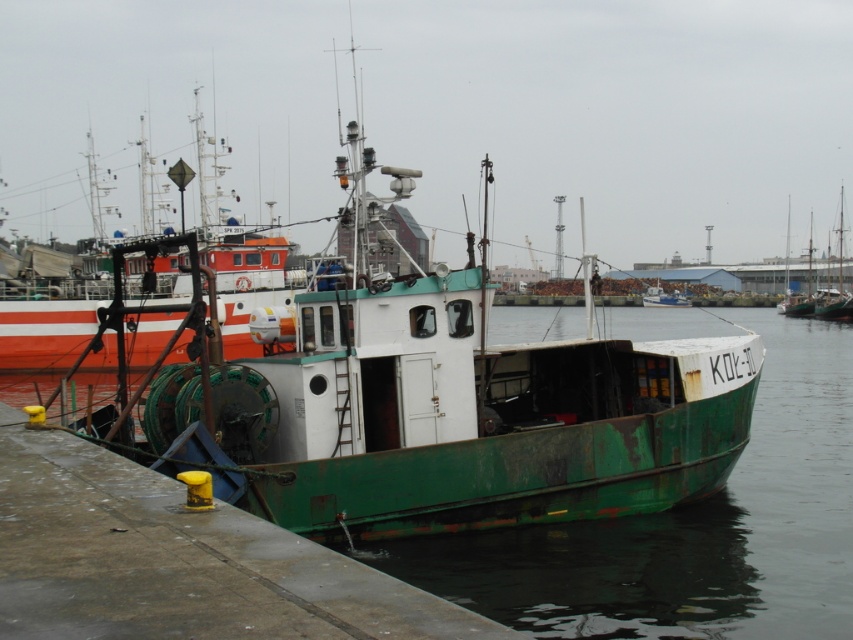
You are a dock worker who needs to secure the green rusty boat at center to the concrete dock at lower left. Based on the scene, which side of the boat should you attach the mooring line to?

The concrete dock at lower left is to the left of the green rusty boat at center, so you should attach the mooring line to the left side of the green rusty boat at center to secure it to the dock.

You are a dock inspector checking the harbor. You need to ensure that the concrete dock at lower left can support the green rusty boat at center. Based on their widths, will the dock be able to support the boat?

The concrete dock at lower left has a lesser width compared to the green rusty boat at center. Since the dock is narrower than the boat, it may not provide sufficient support, so it might not be able to safely support the boat.

You are a marine biologist observing the harbor scene. You notice the green rusty water at lower center and the green rusty boat at center. Which object occupies a larger area in the image?

The green rusty water at lower center is larger in size than the green rusty boat at center, so it occupies a larger area in the image.